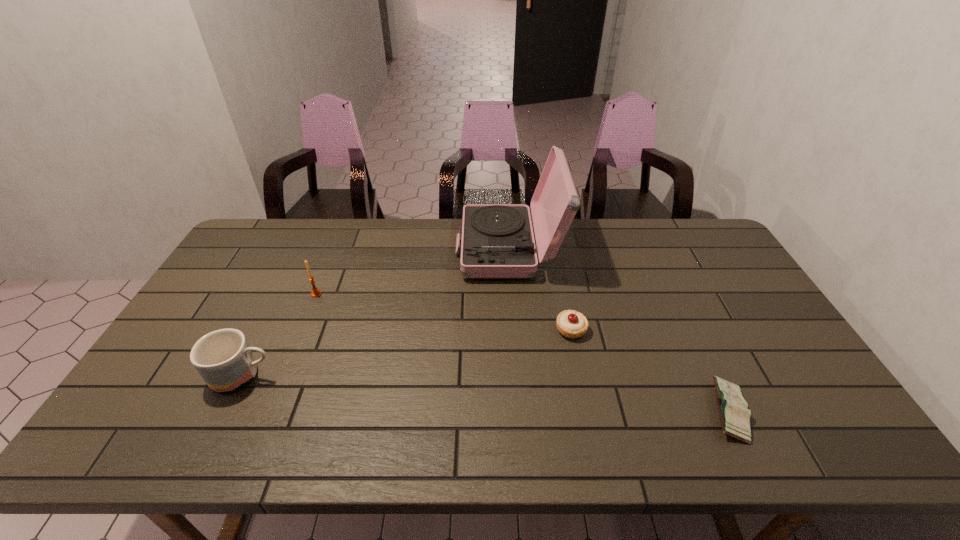
Image resolution: width=960 pixels, height=540 pixels. I want to click on empty location between the mug and the farthest object, so click(376, 312).

Image resolution: width=960 pixels, height=540 pixels. Find the location of `free spot between the candle_holder and the shortest object`. free spot between the candle_holder and the shortest object is located at coordinates (522, 353).

Locate an element on the screen. free space that is in between the leftmost object and the fourth tallest object is located at coordinates (407, 353).

Find the location of a particular element. blank region between the farthest object and the shortest object is located at coordinates (618, 330).

Locate an element on the screen. Image resolution: width=960 pixels, height=540 pixels. free point between the mug and the diary is located at coordinates (486, 394).

In order to click on free space between the diary and the fourth tallest object in this screenshot , I will do `click(650, 370)`.

The image size is (960, 540). Find the location of `vacant space in between the tallest object and the fourth tallest object`. vacant space in between the tallest object and the fourth tallest object is located at coordinates (540, 289).

Choose which object is the nearest neighbor to the third farthest object. Please provide its 2D coordinates. Your answer should be formatted as a tuple, i.e. [(x, y)], where the tuple contains the x and y coordinates of a point satisfying the conditions above.

[(497, 241)]

At what (x,y) coordinates should I click in order to perform the action: click on object that is the third closest to the second shortest object. Please return your answer as a coordinate pair (x, y). The image size is (960, 540). Looking at the image, I should click on (316, 292).

Find the location of a particular element. vacant space that satisfies the following two spatial constraints: 1. on the front side of the pastry; 2. on the right side of the shortest object is located at coordinates (588, 411).